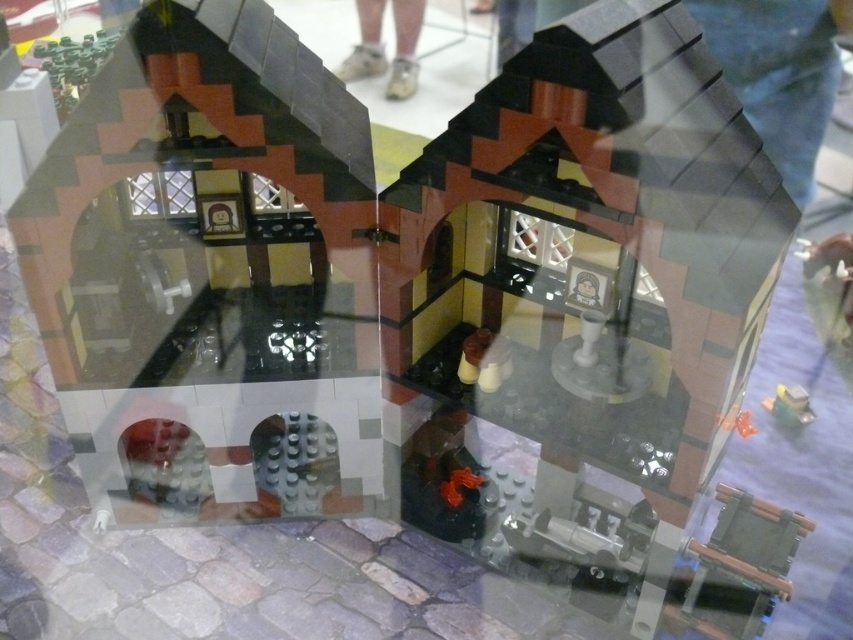
Identify the location of matte black building at center. (210, 273).

Does matte black building at center have a lesser height compared to matte brick house at center?

In fact, matte black building at center may be taller than matte brick house at center.

Does point (169, 502) come farther from viewer compared to point (671, 403)?

Yes.

You are a GUI agent. You are given a task and a screenshot of the screen. Output one action in this format:
    pyautogui.click(x=<x>, y=<y>)
    Task: Click on the matte black building at center
    Image resolution: width=853 pixels, height=640 pixels.
    Given the screenshot: What is the action you would take?
    pyautogui.click(x=210, y=273)

Is matte black building at center wider than white leather shoes at center?

Indeed, matte black building at center has a greater width compared to white leather shoes at center.

Who is shorter, matte black building at center or white leather shoes at center?

Standing shorter between the two is white leather shoes at center.

The image size is (853, 640). Find the location of `matte black building at center`. matte black building at center is located at coordinates (210, 273).

The width and height of the screenshot is (853, 640). What are the coordinates of `matte black building at center` in the screenshot? It's located at (210, 273).

Which is behind, point (726, 372) or point (357, 8)?

The point (357, 8) is behind.

Based on the photo, does matte brick house at center appear on the right side of white leather shoes at center?

Correct, you'll find matte brick house at center to the right of white leather shoes at center.

Is point (688, 80) closer to viewer compared to point (401, 16)?

Yes, it is in front of point (401, 16).

Identify the location of matte brick house at center. This screenshot has height=640, width=853. pyautogui.click(x=599, y=241).